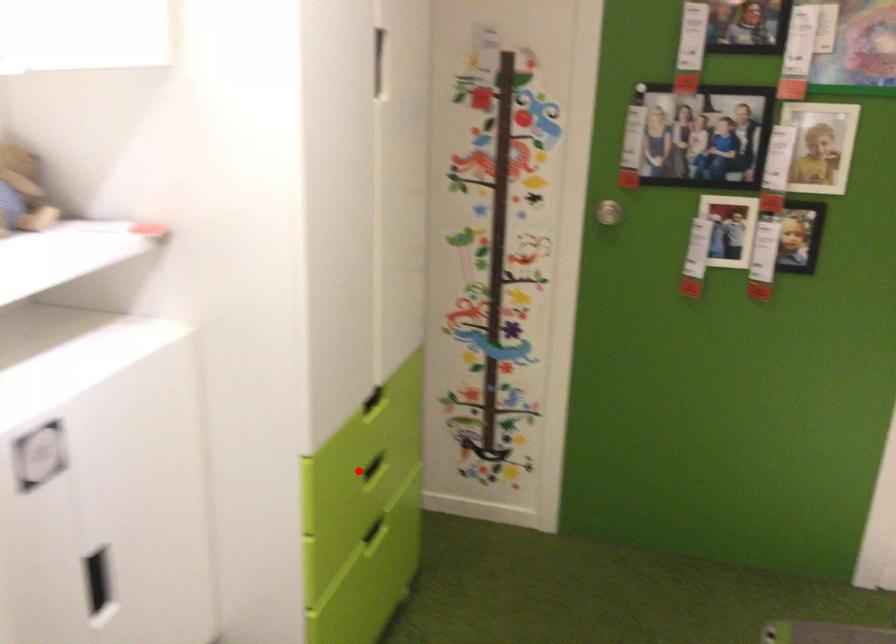
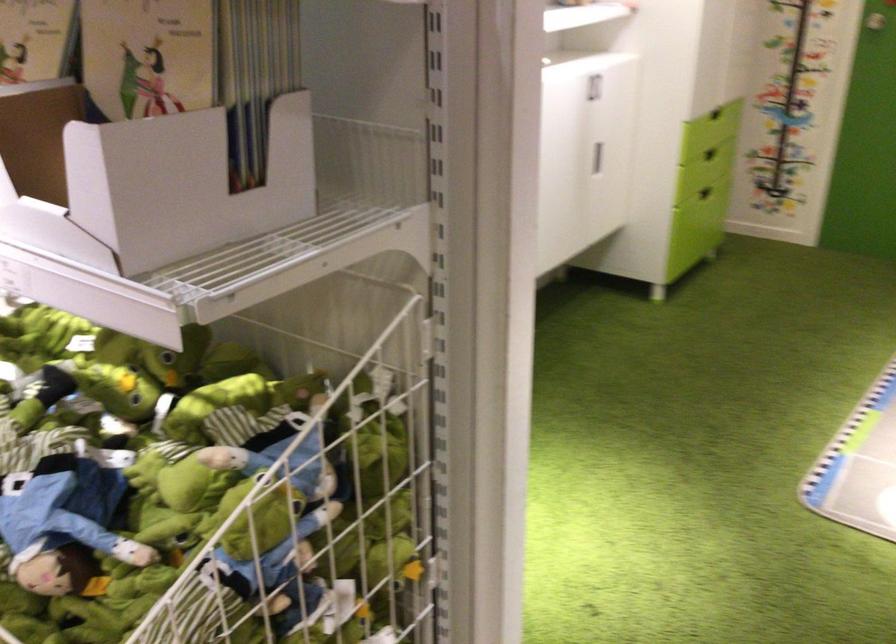
Locate, in the second image, the point that corresponds to the highlighted location in the first image.

(710, 154)